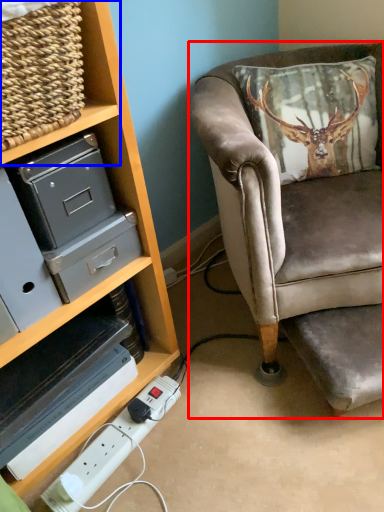
Question: Which object appears farthest to the camera in this image, chair (highlighted by a red box) or shelf (highlighted by a blue box)?

Choices:
 (A) chair
 (B) shelf

Answer: (A)